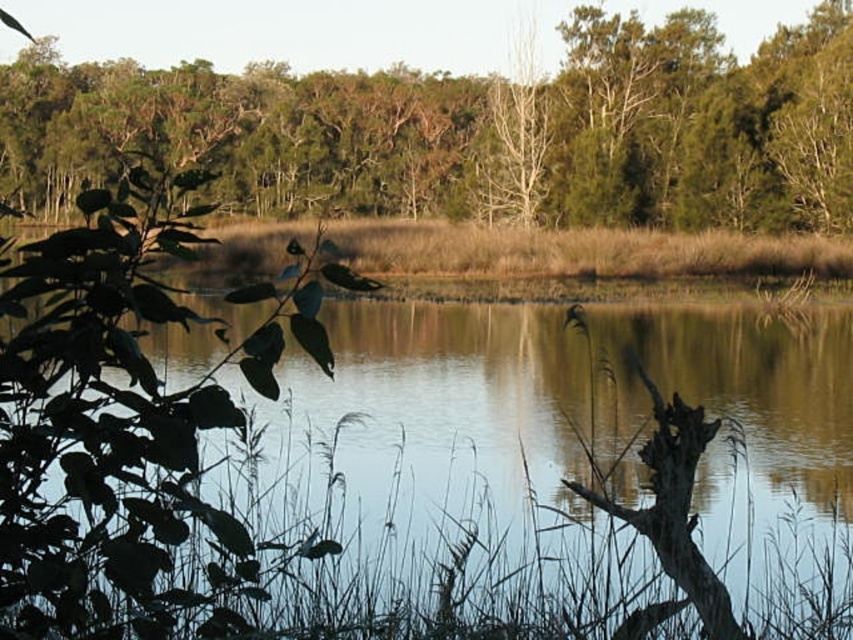
You are standing in the natural landscape scene. You want to walk from the green grass at lower left to the green leafy tree at upper center. Which direction should you move to reach the tree?

To reach the green leafy tree at upper center from the green grass at lower left, you should move towards the upper center direction since the tree is located above and to the center relative to the grass.

You are standing in the natural landscape scene. You see the green grass at lower left and the green leafy tree at upper center. Which object appears narrower in the image?

The green grass at lower left appears narrower than the green leafy tree at upper center.

You are standing at the edge of the pond and notice the green grass at lower left and the green leafy tree at upper center. Which object is closer to you?

The green grass at lower left is closer to you because it is positioned in the foreground, while the green leafy tree at upper center is further away in the background.